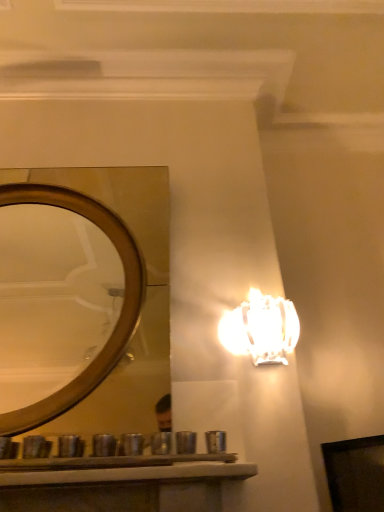
Question: Considering the positions of wooden mirror at center and white glossy lamp at upper right in the image, is wooden mirror at center bigger or smaller than white glossy lamp at upper right?

Choices:
 (A) small
 (B) big

Answer: (B)

Question: In terms of height, does wooden mirror at center look taller or shorter compared to white glossy lamp at upper right?

Choices:
 (A) short
 (B) tall

Answer: (B)

Question: Relative to white glossy lamp at upper right, is wooden mirror at center in front or behind?

Choices:
 (A) front
 (B) behind

Answer: (A)

Question: Is point (249, 316) closer or farther from the camera than point (64, 421)?

Choices:
 (A) closer
 (B) farther

Answer: (B)

Question: From the image's perspective, is white glossy lamp at upper right positioned above or below wooden mirror at center?

Choices:
 (A) below
 (B) above

Answer: (A)

Question: Is white glossy lamp at upper right inside or outside of wooden mirror at center?

Choices:
 (A) outside
 (B) inside

Answer: (A)

Question: Considering the positions of white glossy lamp at upper right and wooden mirror at center in the image, is white glossy lamp at upper right wider or thinner than wooden mirror at center?

Choices:
 (A) wide
 (B) thin

Answer: (B)